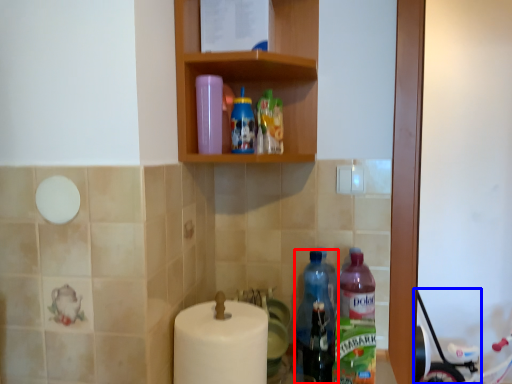
Question: Which point is closer to the camera, bottle (highlighted by a red box) or baby carriage (highlighted by a blue box)?

Choices:
 (A) bottle
 (B) baby carriage

Answer: (A)